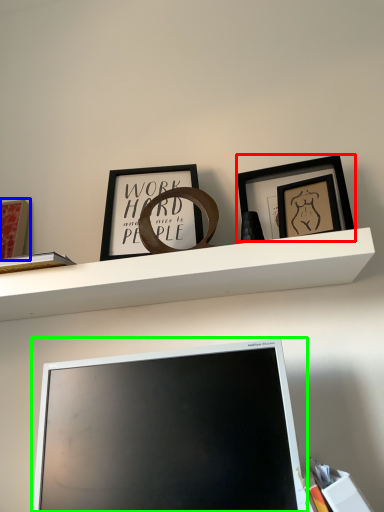
Question: Which object is the closest to the picture frame (highlighted by a red box)? Choose among these: picture frame (highlighted by a blue box) or computer monitor (highlighted by a green box).

Choices:
 (A) picture frame
 (B) computer monitor

Answer: (B)